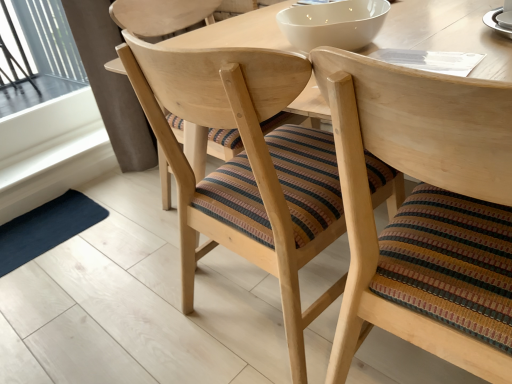
In order to click on vacant area that is in front of dark blue fabric mat at lower left in this screenshot , I will do `click(49, 287)`.